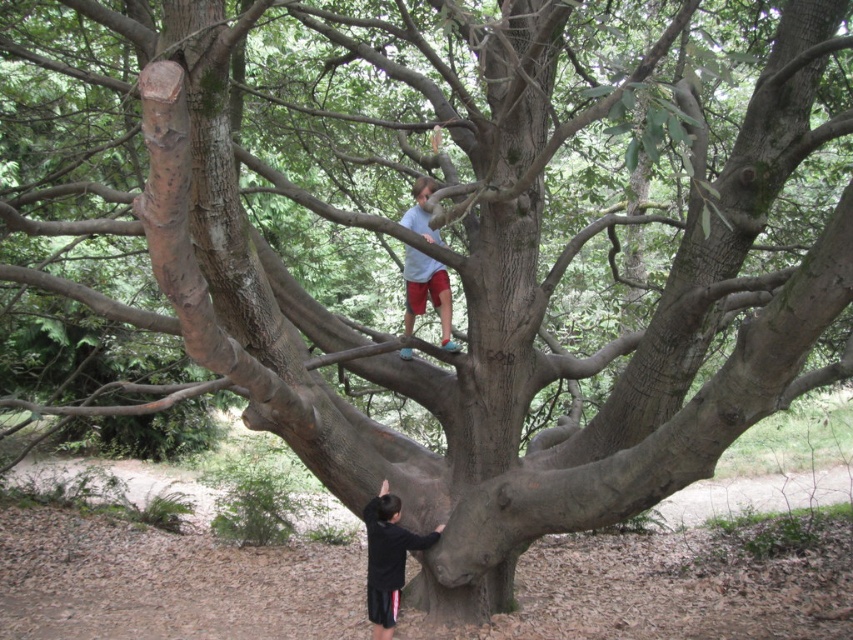
You are a photographer trying to capture a photo of the two children near the tree. You notice a specific point marked at coordinates (387, 557). What object is located at this point?

The point at coordinates (387, 557) marks the black matte shirt at lower center.

You are a parent looking at your children playing near a tree. You notice the black matte shirt at lower center and the light blue shirt at upper center. Which child is closer to the ground?

The black matte shirt at lower center is positioned under the light blue shirt at upper center, so the child wearing the black matte shirt at lower center is closer to the ground.

You are a photographer standing in front of the tree. You want to take a photo that includes both the black matte shirt at lower center and the light blue shirt at upper center. Which child should you focus on first to ensure both are in focus?

You should focus on the black matte shirt at lower center first because it is closer to the viewer than the light blue shirt at upper center. By focusing on the closer child, you can ensure both are in focus as the light blue shirt at upper center is further away.